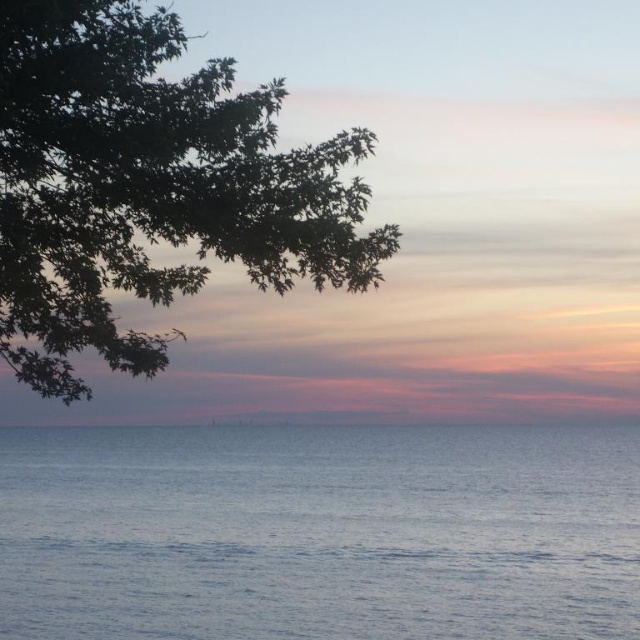
You are standing on the beach looking out at the scene. You notice the blue smooth water at lower center and the green leafy tree at upper left. Which object appears to take up more horizontal space in the image?

The blue smooth water at lower center might be wider than green leafy tree at upper left, so it likely takes up more horizontal space in the image.

You are standing at the center of the image and want to walk towards the blue smooth water at lower center. Based on the coordinates provided, in which direction should you move?

The blue smooth water at lower center is located at point 0.833 on the x axis and 0.5 on the y axis. Since you are at the center of the image, which is at point 0.5 on both axes, you should move to the right to reach the blue smooth water at lower center.

You are standing on the beach and looking at the blue smooth water at lower center and the green leafy tree at upper left. Which object appears taller in the scene?

The green leafy tree at upper left appears taller than the blue smooth water at lower center.